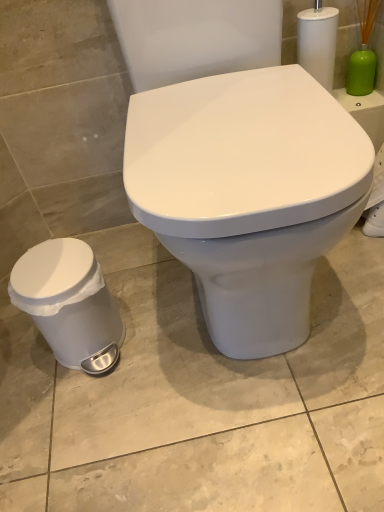
Locate an element on the screen. blank space to the left of white glossy toilet at center is located at coordinates (115, 307).